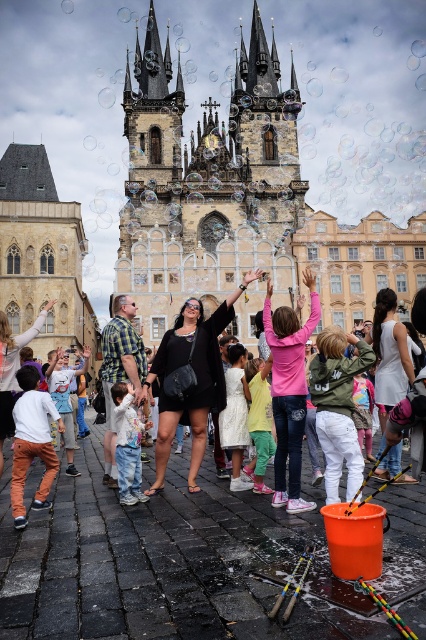
You are standing in the town square and want to take a photo of the stone gothic tower at center and the white matte dress at center. Which object should you frame first in your camera viewfinder to ensure both are in the shot?

You should frame the stone gothic tower at center first because it is to the left of the white matte dress at center, so positioning the tower first ensures both can be included in the photo.

You are a photographer standing at the center of the town square. You want to take a photo of both the white cotton shirt at lower left and the white matte dress at center in the same frame. Given that your camera has a 50mm lens, which has a field of view of approximately 46 degrees, can you fit both objects into your photo without moving your position?

The white cotton shirt at lower left and white matte dress at center are 36.73 meters apart from each other. With a 50mm lens providing a 46 degree field of view, the maximum distance between two objects that can be captured in the same frame would depend on their angular separation. However, at 36.73 meters apart, the angular separation would likely exceed the lens capabilities, making it difficult to capture both in the same frame without moving.

You are standing in the town square and want to walk from point A to point B. Point A is at coordinate point(290,419) and point B is at coordinate point(249,368). Which point is closer to you when you start at point A?

Point A is at coordinate point(290,419) and point B is at coordinate point(249,368). Since you are starting at point A, you are already at point A, so point A is closer to you.